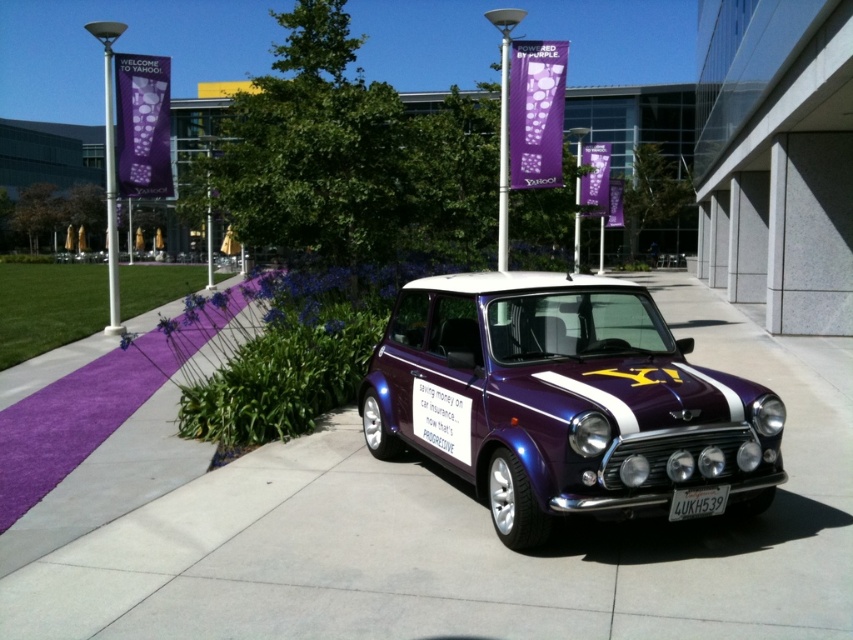
Is shiny purple car at center wider than white plastic license plate at center?

Correct, the width of shiny purple car at center exceeds that of white plastic license plate at center.

Can you confirm if shiny purple car at center is positioned to the right of white plastic license plate at center?

Incorrect, shiny purple car at center is not on the right side of white plastic license plate at center.

Where is `shiny purple car at center`? The image size is (853, 640). shiny purple car at center is located at coordinates (561, 401).

Can you confirm if purple asphalt at center is bigger than white plastic license plate at center?

Indeed, purple asphalt at center has a larger size compared to white plastic license plate at center.

Is point (461, 625) more distant than point (705, 500)?

No, (461, 625) is in front of (705, 500).

Which is in front, point (840, 397) or point (668, 515)?

Positioned in front is point (668, 515).

You are a GUI agent. You are given a task and a screenshot of the screen. Output one action in this format:
    pyautogui.click(x=<x>, y=<y>)
    Task: Click on the purple asphalt at center
    This screenshot has width=853, height=640.
    Given the screenshot: What is the action you would take?
    pyautogui.click(x=467, y=538)

Between purple asphalt at center and shiny purple car at center, which one appears on the left side from the viewer's perspective?

shiny purple car at center is more to the left.

Who is shorter, purple asphalt at center or shiny purple car at center?

purple asphalt at center

Who is more distant from viewer, (395,572) or (381,412)?

The point (381,412) is behind.

Image resolution: width=853 pixels, height=640 pixels. Identify the location of purple asphalt at center. (467, 538).